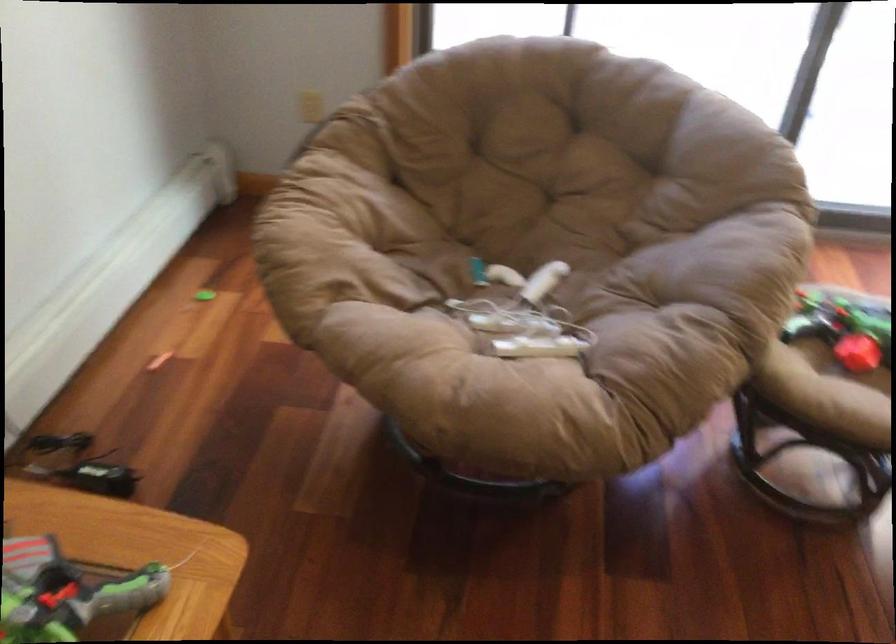
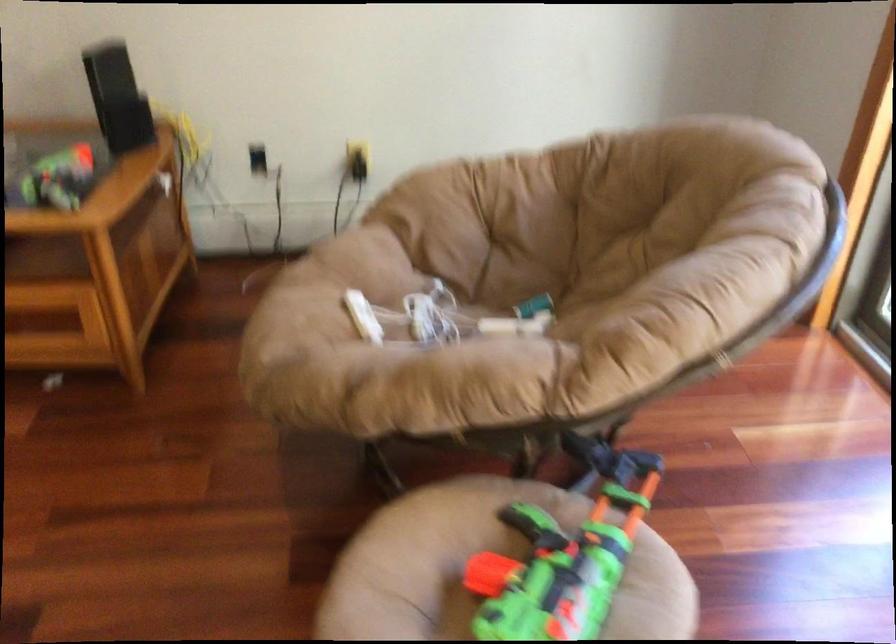
The point at (x=514, y=313) is marked in the first image. Where is the corresponding point in the second image?

(442, 317)